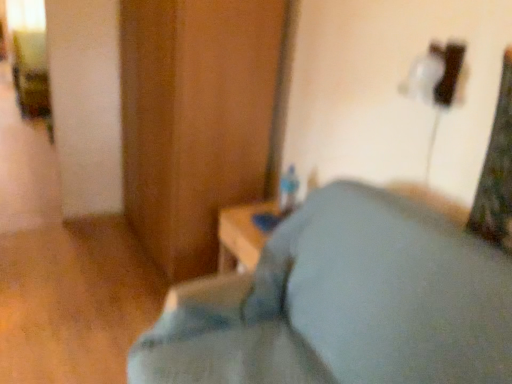
What do you see at coordinates (343, 304) in the screenshot? The height and width of the screenshot is (384, 512). I see `light blue fabric pillow at lower center` at bounding box center [343, 304].

Locate an element on the screen. The width and height of the screenshot is (512, 384). light blue fabric pillow at lower center is located at coordinates (343, 304).

The image size is (512, 384). Describe the element at coordinates (195, 119) in the screenshot. I see `wooden dresser at center` at that location.

What is the approximate width of wooden dresser at center?

wooden dresser at center is 63.30 centimeters in width.

Locate an element on the screen. This screenshot has width=512, height=384. wooden dresser at center is located at coordinates click(195, 119).

Where is `light blue fabric pillow at lower center`? The height and width of the screenshot is (384, 512). light blue fabric pillow at lower center is located at coordinates (343, 304).

Is wooden dresser at center at the right side of light blue fabric pillow at lower center?

No.

Which is behind, wooden dresser at center or light blue fabric pillow at lower center?

wooden dresser at center is further from the camera.

Does point (162, 36) appear closer or farther from the camera than point (374, 355)?

Point (162, 36) appears to be farther away from the viewer than point (374, 355).

From the image's perspective, does wooden dresser at center appear lower than light blue fabric pillow at lower center?

No, from the image's perspective, wooden dresser at center is not beneath light blue fabric pillow at lower center.

From a real-world perspective, is wooden dresser at center above or below light blue fabric pillow at lower center?

In terms of real-world spatial position, wooden dresser at center is above light blue fabric pillow at lower center.

Does wooden dresser at center have a greater width compared to light blue fabric pillow at lower center?

No, wooden dresser at center is not wider than light blue fabric pillow at lower center.

Considering the sizes of objects wooden dresser at center and light blue fabric pillow at lower center in the image provided, who is taller, wooden dresser at center or light blue fabric pillow at lower center?

With more height is wooden dresser at center.

In terms of size, does wooden dresser at center appear bigger or smaller than light blue fabric pillow at lower center?

In the image, wooden dresser at center appears to be larger than light blue fabric pillow at lower center.

Based on the photo, would you say light blue fabric pillow at lower center is part of wooden dresser at center's contents?

No, light blue fabric pillow at lower center is not surrounded by wooden dresser at center.

Based on the photo, is there a large distance between wooden dresser at center and light blue fabric pillow at lower center?

That's not correct — wooden dresser at center is a little close to light blue fabric pillow at lower center.

Is wooden dresser at center aimed at light blue fabric pillow at lower center?

No, wooden dresser at center is not aimed at light blue fabric pillow at lower center.

What are the coordinates of `furniture lying below the wooden dresser at center (from the image's perspective)` in the screenshot? It's located at (343, 304).

Would you say light blue fabric pillow at lower center is to the left or to the right of wooden dresser at center in the picture?

light blue fabric pillow at lower center is positioned on wooden dresser at center's right side.

Is light blue fabric pillow at lower center closer to camera compared to wooden dresser at center?

Yes, light blue fabric pillow at lower center is closer to the viewer.

Is point (431, 286) closer or farther from the camera than point (253, 99)?

Point (431, 286) is closer to the camera than point (253, 99).

From the image's perspective, is light blue fabric pillow at lower center under wooden dresser at center?

Yes, from the image's perspective, light blue fabric pillow at lower center is below wooden dresser at center.

From a real-world perspective, who is located lower, light blue fabric pillow at lower center or wooden dresser at center?

light blue fabric pillow at lower center is physically lower.

Which of these two, light blue fabric pillow at lower center or wooden dresser at center, is thinner?

Thinner between the two is wooden dresser at center.

In terms of height, does light blue fabric pillow at lower center look taller or shorter compared to wooden dresser at center?

light blue fabric pillow at lower center is shorter than wooden dresser at center.

Considering the sizes of objects light blue fabric pillow at lower center and wooden dresser at center in the image provided, who is smaller, light blue fabric pillow at lower center or wooden dresser at center?

light blue fabric pillow at lower center is smaller.

From the picture: Is wooden dresser at center surrounded by light blue fabric pillow at lower center?

Actually, wooden dresser at center is outside light blue fabric pillow at lower center.

Is light blue fabric pillow at lower center far from wooden dresser at center?

No.

Is light blue fabric pillow at lower center facing away from wooden dresser at center?

That's not correct — light blue fabric pillow at lower center is not looking away from wooden dresser at center.

Where is `furniture in front of the wooden dresser at center`? The height and width of the screenshot is (384, 512). furniture in front of the wooden dresser at center is located at coordinates point(343,304).

At what (x,y) coordinates should I click in order to perform the action: click on furniture lying in front of the wooden dresser at center. Please return your answer as a coordinate pair (x, y). Image resolution: width=512 pixels, height=384 pixels. Looking at the image, I should click on (343, 304).

At what (x,y) coordinates should I click in order to perform the action: click on furniture that appears on the right of wooden dresser at center. Please return your answer as a coordinate pair (x, y). Looking at the image, I should click on (343, 304).